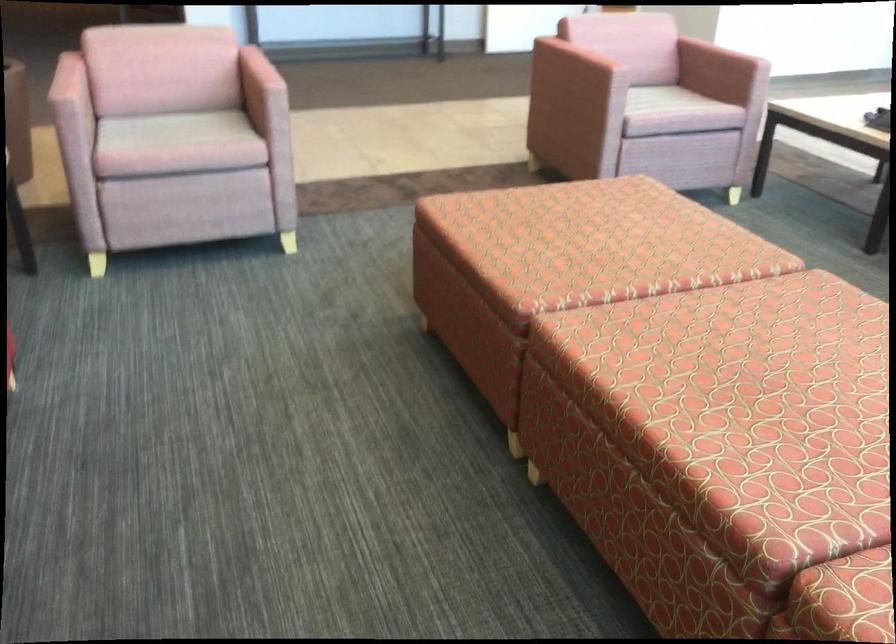
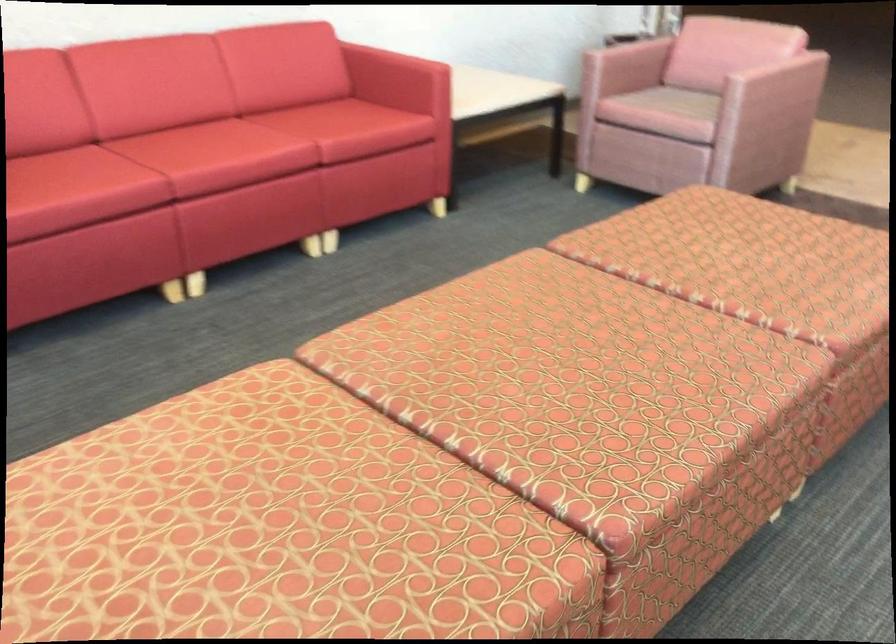
Where in the second image is the point corresponding to (x=588, y=223) from the first image?

(762, 245)